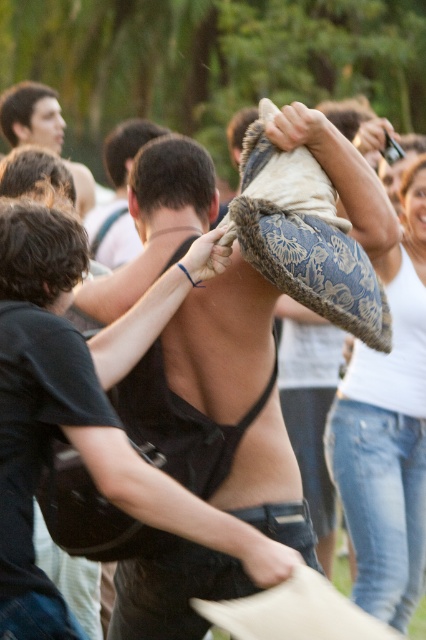
From the picture: You are a photographer trying to capture the most dynamic shot of the pillow fight. You notice the black fabric bra at center and the dark brown hair at upper left. Which object should you focus on to ensure it appears larger in your photo?

The black fabric bra at center should be focused on because it is much taller than the dark brown hair at upper left, making it appear larger in the photo.

You are a photographer trying to capture a clear shot of the black fabric bra at center and the dark brown hair at upper left. Which object should you focus on first to ensure both are in focus?

The black fabric bra at center is in front of the dark brown hair at upper left, so you should focus on the black fabric bra at center first to ensure both are in focus.

You are taking a photo of the lively outdoor pillow fight scene. You want to focus on the two points in the image labeled as point (20,346) and point (348,397). Which point should you adjust your camera focus to first if you want to capture both points clearly in the same frame?

Point (20,346) is closer to the camera than point (348,397), so you should focus on point (20,346) first to ensure both points are in focus.